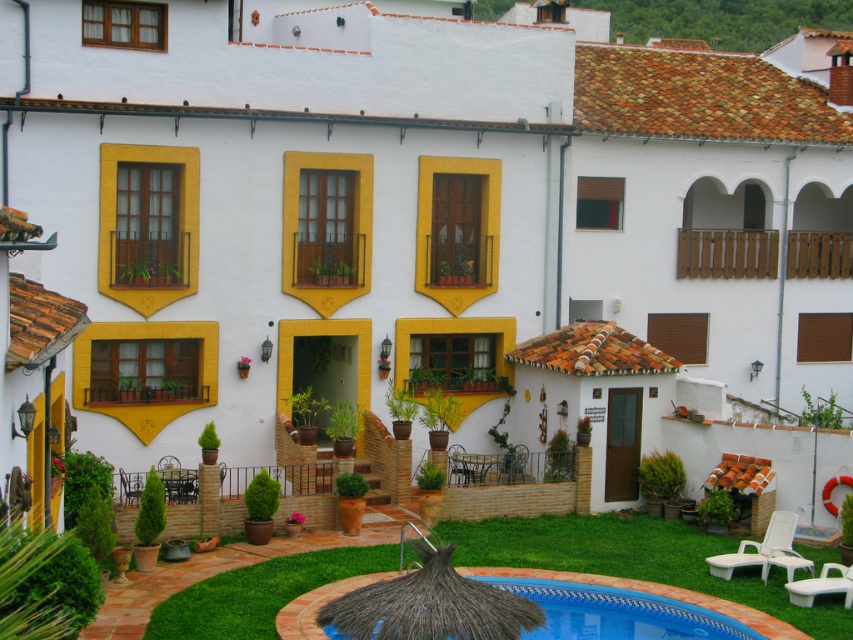
You are standing at the entrance of the Mediterranean building and want to walk to the green grass at lower center. According to the coordinates provided, in which general direction should you move from the entrance to reach the green grass?

The green grass at lower center is located at coordinates approximately 0.875 on the x axis and 0.747 on the y axis. Since the entrance is at the front of the building, moving towards the lower center would mean heading forward and slightly to the right from the entrance.

You are standing on the patio of the Mediterranean building and want to walk to the blue tile swimming pool at lower center without stepping on the green grass at lower center. Is there enough space between them to do so?

The green grass at lower center and blue tile swimming pool at lower center are 6.59 feet apart from each other, so there is enough space between them to walk without stepping on the green grass at lower center.

Looking at this image, you are standing at the entrance of the Mediterranean building and looking towards the lower center. What do you see at the point marked by the coordinates (636, 560)?

At the coordinates (636, 560), there is green grass at lower center.